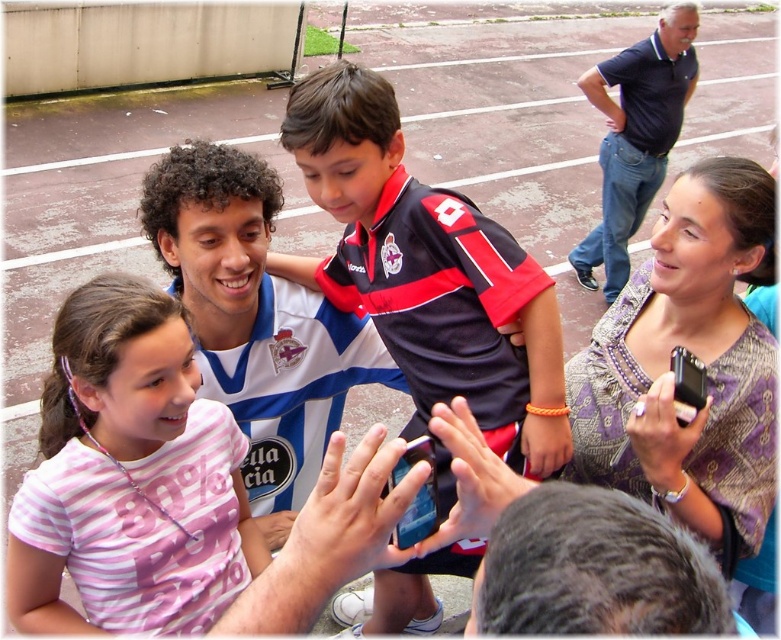
Is dark blue jersey at center further to the viewer compared to dark blue polo shirt at upper right?

No, it is not.

In the scene shown: Does dark blue jersey at center have a greater width compared to dark blue polo shirt at upper right?

No.

Based on the photo, who is more distant from viewer, (398, 604) or (653, 88)?

Positioned behind is point (653, 88).

Where is `dark blue jersey at center`? This screenshot has height=640, width=781. dark blue jersey at center is located at coordinates (426, 273).

This screenshot has width=781, height=640. Describe the element at coordinates (635, 136) in the screenshot. I see `dark blue polo shirt at upper right` at that location.

Image resolution: width=781 pixels, height=640 pixels. Describe the element at coordinates (635, 136) in the screenshot. I see `dark blue polo shirt at upper right` at that location.

Where is `dark blue polo shirt at upper right`? The height and width of the screenshot is (640, 781). dark blue polo shirt at upper right is located at coordinates (635, 136).

Is pink striped shirt at center positioned before dark blue jersey at center?

That is True.

Does pink striped shirt at center appear on the left side of dark blue jersey at center?

Correct, you'll find pink striped shirt at center to the left of dark blue jersey at center.

Which is behind, point (155, 580) or point (458, 230)?

The point (458, 230) is more distant.

Locate an element on the screen. This screenshot has height=640, width=781. pink striped shirt at center is located at coordinates (170, 492).